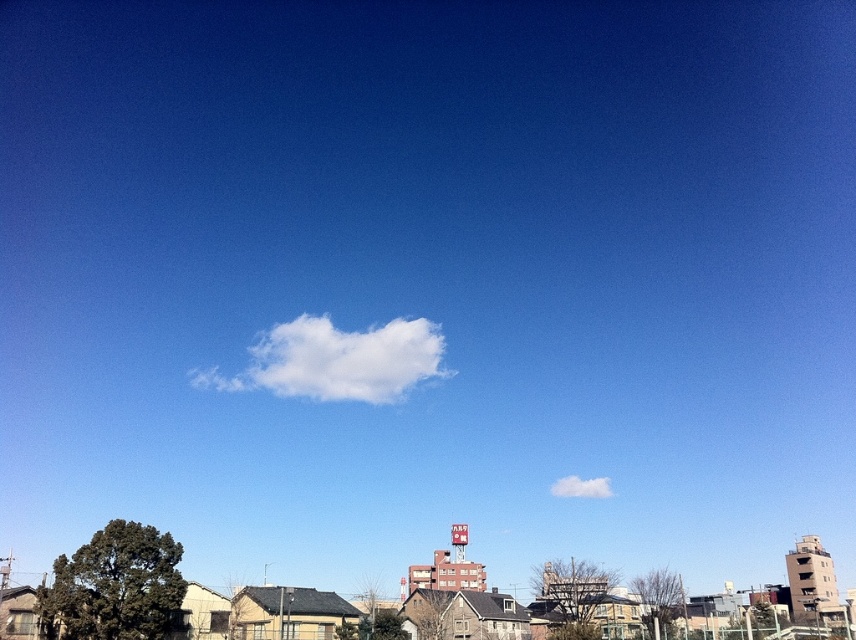
Question: Does white fluffy cloud at center come behind white fluffy cloud at upper center?

Choices:
 (A) yes
 (B) no

Answer: (B)

Question: Can you confirm if white fluffy cloud at center is thinner than white fluffy cloud at upper center?

Choices:
 (A) no
 (B) yes

Answer: (A)

Question: Is white fluffy cloud at center bigger than white fluffy cloud at upper center?

Choices:
 (A) yes
 (B) no

Answer: (A)

Question: Which point appears closest to the camera in this image?

Choices:
 (A) (599, 497)
 (B) (390, 336)

Answer: (B)

Question: Which point is closer to the camera?

Choices:
 (A) white fluffy cloud at center
 (B) white fluffy cloud at upper center

Answer: (A)